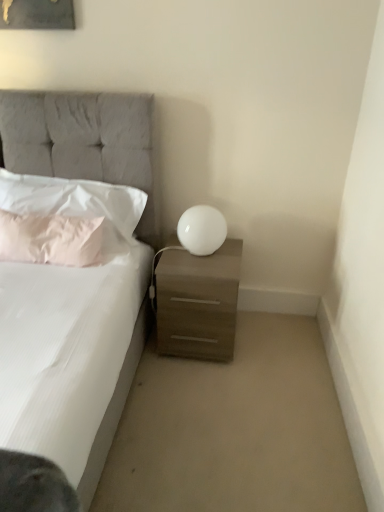
Where is `white fabric pillow at left, which ranks as the 1th pillow in top-to-bottom order`? This screenshot has height=512, width=384. white fabric pillow at left, which ranks as the 1th pillow in top-to-bottom order is located at coordinates (73, 199).

Describe the element at coordinates (202, 230) in the screenshot. Image resolution: width=384 pixels, height=512 pixels. I see `white glossy sphere at right` at that location.

Where is `white fabric pillow at left, positioned as the 2th pillow in bottom-to-top order`? The height and width of the screenshot is (512, 384). white fabric pillow at left, positioned as the 2th pillow in bottom-to-top order is located at coordinates (73, 199).

Considering the positions of objects matte wood nightstand at lower right and white glossy sphere at right in the image provided, who is behind, matte wood nightstand at lower right or white glossy sphere at right?

white glossy sphere at right is behind.

From the image's perspective, is matte wood nightstand at lower right beneath white glossy sphere at right?

Yes.

In the scene shown: Does matte wood nightstand at lower right have a lesser width compared to white glossy sphere at right?

No, matte wood nightstand at lower right is not thinner than white glossy sphere at right.

In the scene shown: Can you see white glossy sphere at right touching pink fabric pillow at left, arranged as the second pillow when viewed from the top?

No, white glossy sphere at right is not making contact with pink fabric pillow at left, arranged as the second pillow when viewed from the top.

Is point (207, 213) closer or farther from the camera than point (52, 244)?

Point (207, 213) is farther from the camera than point (52, 244).

Is white glossy sphere at right taller or shorter than pink fabric pillow at left, positioned as the 1th pillow in bottom-to-top order?

white glossy sphere at right is shorter than pink fabric pillow at left, positioned as the 1th pillow in bottom-to-top order.

Who is bigger, white glossy sphere at right or pink fabric pillow at left, positioned as the 1th pillow in bottom-to-top order?

pink fabric pillow at left, positioned as the 1th pillow in bottom-to-top order.

Looking at this image, from a real-world perspective, which is physically below, white fabric pillow at left, which ranks as the 1th pillow in top-to-bottom order, or matte wood nightstand at lower right?

matte wood nightstand at lower right is physically lower.

Is white fabric pillow at left, which ranks as the 1th pillow in top-to-bottom order, to the left of matte wood nightstand at lower right from the viewer's perspective?

Correct, you'll find white fabric pillow at left, which ranks as the 1th pillow in top-to-bottom order, to the left of matte wood nightstand at lower right.

From the image's perspective, which object appears higher, white fabric pillow at left, positioned as the 2th pillow in bottom-to-top order, or matte wood nightstand at lower right?

From the image's view, white fabric pillow at left, positioned as the 2th pillow in bottom-to-top order, is above.

Between pink fabric pillow at left, positioned as the 1th pillow in bottom-to-top order, and white glossy sphere at right, which one has smaller width?

Thinner between the two is pink fabric pillow at left, positioned as the 1th pillow in bottom-to-top order.

Could you tell me if pink fabric pillow at left, arranged as the second pillow when viewed from the top, is facing white glossy sphere at right?

No, pink fabric pillow at left, arranged as the second pillow when viewed from the top, is not oriented towards white glossy sphere at right.

Is pink fabric pillow at left, arranged as the second pillow when viewed from the top, in front of white glossy sphere at right?

Yes.

Is white glossy sphere at right a part of pink fabric pillow at left, arranged as the second pillow when viewed from the top?

Actually, white glossy sphere at right is outside pink fabric pillow at left, arranged as the second pillow when viewed from the top.

Image resolution: width=384 pixels, height=512 pixels. In the image, there is a white fabric pillow at left, positioned as the 2th pillow in bottom-to-top order. What are the coordinates of `bed below it (from the image's perspective)` in the screenshot? It's located at (83, 141).

Is tufted fabric bed at upper left taller or shorter than white fabric pillow at left, positioned as the 2th pillow in bottom-to-top order?

tufted fabric bed at upper left is taller than white fabric pillow at left, positioned as the 2th pillow in bottom-to-top order.

Between point (63, 152) and point (99, 206), which one is positioned behind?

Point (99, 206)

Would you consider tufted fabric bed at upper left to be distant from white glossy sphere at right?

No.

Measure the distance between tufted fabric bed at upper left and white glossy sphere at right.

tufted fabric bed at upper left is 19.35 inches from white glossy sphere at right.

Could you tell me if tufted fabric bed at upper left is turned towards white glossy sphere at right?

No, tufted fabric bed at upper left is not turned towards white glossy sphere at right.

Considering the positions of objects tufted fabric bed at upper left and white glossy sphere at right in the image provided, who is more to the right, tufted fabric bed at upper left or white glossy sphere at right?

From the viewer's perspective, white glossy sphere at right appears more on the right side.

From the image's perspective, is matte wood nightstand at lower right positioned above or below tufted fabric bed at upper left?

Based on their image positions, matte wood nightstand at lower right is located beneath tufted fabric bed at upper left.

Is tufted fabric bed at upper left inside matte wood nightstand at lower right?

No, tufted fabric bed at upper left is not a part of matte wood nightstand at lower right.

Who is bigger, matte wood nightstand at lower right or tufted fabric bed at upper left?

tufted fabric bed at upper left.

How many degrees apart are the facing directions of matte wood nightstand at lower right and tufted fabric bed at upper left?

They differ by 2.12 degrees in their facing directions.

You are a GUI agent. You are given a task and a screenshot of the screen. Output one action in this format:
    pyautogui.click(x=<x>, y=<y>)
    Task: Click on the nightstand lying in front of the white glossy sphere at right
    The height and width of the screenshot is (512, 384).
    Given the screenshot: What is the action you would take?
    pyautogui.click(x=198, y=302)

The height and width of the screenshot is (512, 384). Find the location of `table lamp above the pink fabric pillow at left, arranged as the second pillow when viewed from the top (from a real-world perspective)`. table lamp above the pink fabric pillow at left, arranged as the second pillow when viewed from the top (from a real-world perspective) is located at coordinates (202, 230).

Which object lies further to the anchor point tufted fabric bed at upper left, white fabric pillow at left, positioned as the 2th pillow in bottom-to-top order, or matte wood nightstand at lower right?

Based on the image, matte wood nightstand at lower right appears to be further to tufted fabric bed at upper left.

Estimate the real-world distances between objects in this image. Which object is further from white glossy sphere at right, pink fabric pillow at left, positioned as the 1th pillow in bottom-to-top order, or matte wood nightstand at lower right?

pink fabric pillow at left, positioned as the 1th pillow in bottom-to-top order, is positioned further to the anchor white glossy sphere at right.

From the picture: Considering their positions, is white glossy sphere at right positioned closer to white fabric pillow at left, which ranks as the 1th pillow in top-to-bottom order, than pink fabric pillow at left, positioned as the 1th pillow in bottom-to-top order?

Among the two, pink fabric pillow at left, positioned as the 1th pillow in bottom-to-top order, is located nearer to white fabric pillow at left, which ranks as the 1th pillow in top-to-bottom order.

From the image, which object appears to be farther from white fabric pillow at left, which ranks as the 1th pillow in top-to-bottom order, matte wood nightstand at lower right or white glossy sphere at right?

matte wood nightstand at lower right is positioned further to the anchor white fabric pillow at left, which ranks as the 1th pillow in top-to-bottom order.

When comparing their distances from pink fabric pillow at left, arranged as the second pillow when viewed from the top, does tufted fabric bed at upper left or white fabric pillow at left, which ranks as the 1th pillow in top-to-bottom order, seem further?

tufted fabric bed at upper left lies further to pink fabric pillow at left, arranged as the second pillow when viewed from the top, than the other object.

Looking at the image, which one is located further to tufted fabric bed at upper left, white glossy sphere at right or white fabric pillow at left, which ranks as the 1th pillow in top-to-bottom order?

Among the two, white glossy sphere at right is located further to tufted fabric bed at upper left.

Looking at the image, which one is located further to pink fabric pillow at left, positioned as the 1th pillow in bottom-to-top order, tufted fabric bed at upper left or matte wood nightstand at lower right?

matte wood nightstand at lower right.

When comparing their distances from white fabric pillow at left, positioned as the 2th pillow in bottom-to-top order, does tufted fabric bed at upper left or white glossy sphere at right seem closer?

Among the two, tufted fabric bed at upper left is located nearer to white fabric pillow at left, positioned as the 2th pillow in bottom-to-top order.

What are the coordinates of `nightstand positioned between tufted fabric bed at upper left and white fabric pillow at left, which ranks as the 1th pillow in top-to-bottom order, from near to far` in the screenshot? It's located at (198, 302).

The width and height of the screenshot is (384, 512). Find the location of `pillow located between pink fabric pillow at left, arranged as the second pillow when viewed from the top, and matte wood nightstand at lower right in the left-right direction`. pillow located between pink fabric pillow at left, arranged as the second pillow when viewed from the top, and matte wood nightstand at lower right in the left-right direction is located at coordinates (73, 199).

Image resolution: width=384 pixels, height=512 pixels. I want to click on nightstand between white fabric pillow at left, positioned as the 2th pillow in bottom-to-top order, and white glossy sphere at right from left to right, so (x=198, y=302).

Where is `pillow between tufted fabric bed at upper left and pink fabric pillow at left, positioned as the 1th pillow in bottom-to-top order, along the z-axis`? pillow between tufted fabric bed at upper left and pink fabric pillow at left, positioned as the 1th pillow in bottom-to-top order, along the z-axis is located at coordinates [x=73, y=199].